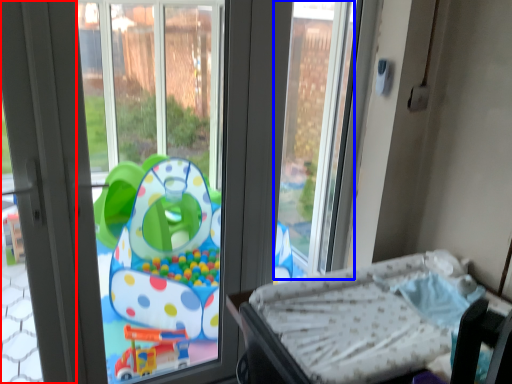
Question: Which object appears farthest to the camera in this image, screen door (highlighted by a red box) or window screen (highlighted by a blue box)?

Choices:
 (A) screen door
 (B) window screen

Answer: (B)